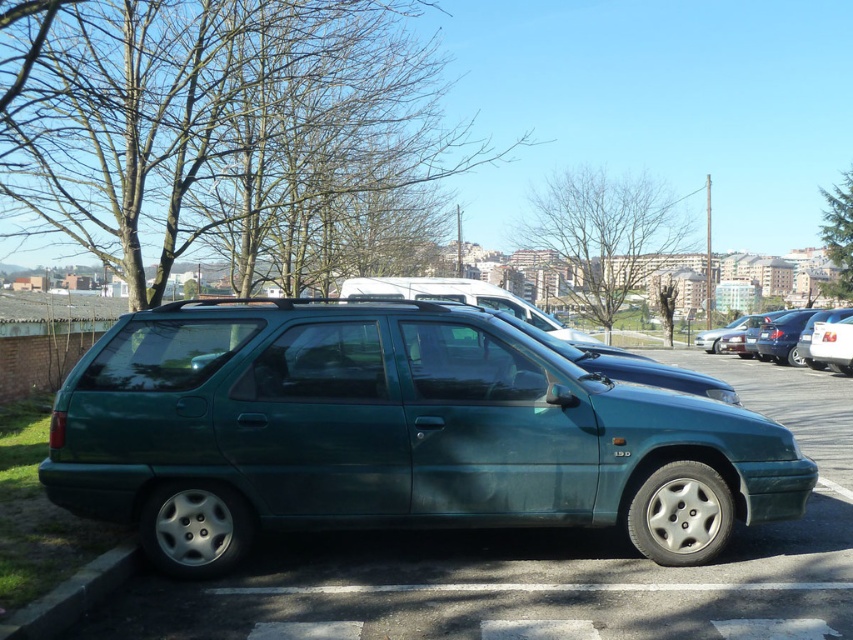
You are a delivery driver who needs to park your truck in the parking lot. You see the metallic silver sedan at center and the white glossy van at upper center. Which vehicle should you avoid parking too close to if you want to leave first?

You should avoid parking too close to the metallic silver sedan at center because it is bigger than the white glossy van at upper center, which might require more space when leaving.

You are a delivery driver who needs to park your vehicle between the green concrete curb at lower left and the metallic silver sedan at center. Considering their widths, can your 2.5 meter wide truck fit in the space between them?

The green concrete curb at lower left has a lesser width compared to metallic silver sedan at center. Since the curb is narrower, the space between them might be sufficient for your 2.5 meter wide truck, but you should measure the actual space before proceeding.